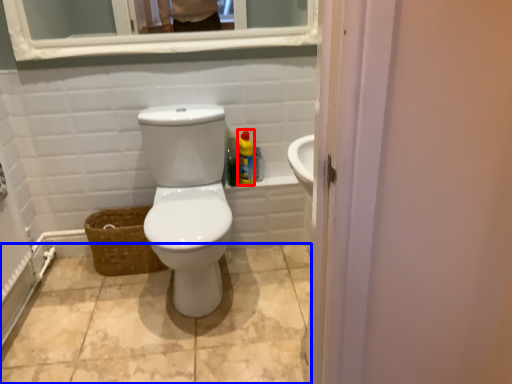
Question: Which point is closer to the camera, cleaning product (highlighted by a red box) or ceramic tile (highlighted by a blue box)?

Choices:
 (A) cleaning product
 (B) ceramic tile

Answer: (B)